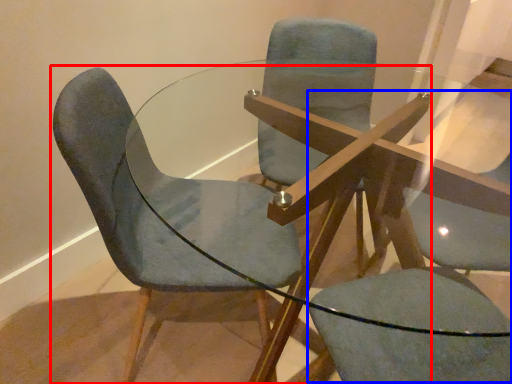
Question: Among these objects, which one is farthest to the camera, chair (highlighted by a red box) or swivel chair (highlighted by a blue box)?

Choices:
 (A) chair
 (B) swivel chair

Answer: (A)